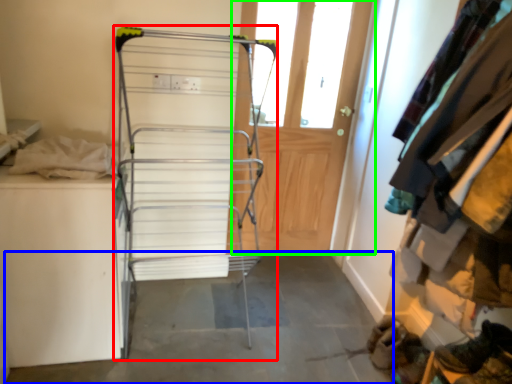
Question: Based on their relative distances, which object is farther from furniture (highlighted by a red box)? Choose from concrete (highlighted by a blue box) and door (highlighted by a green box).

Choices:
 (A) concrete
 (B) door

Answer: (B)